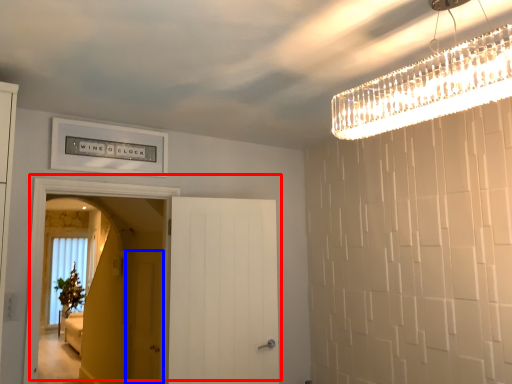
Question: Which of the following is the closest to the observer, door (highlighted by a red box) or screen door (highlighted by a blue box)?

Choices:
 (A) door
 (B) screen door

Answer: (A)